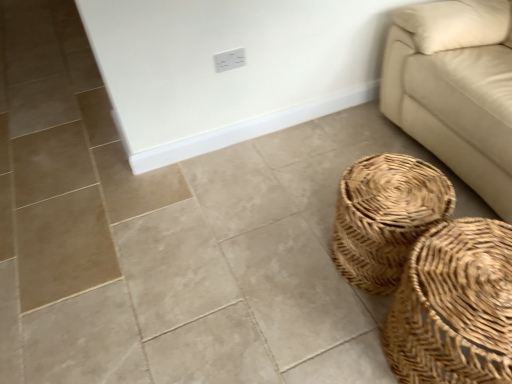
Question: Considering their positions, is woven natural basket at lower right, which appears as the first basket when viewed from the back, located in front of or behind white plastic electric outlet at upper center?

Choices:
 (A) front
 (B) behind

Answer: (A)

Question: Which is correct: woven natural basket at lower right, the second basket viewed from the front, is inside white plastic electric outlet at upper center, or outside of it?

Choices:
 (A) inside
 (B) outside

Answer: (B)

Question: Which object is the farthest from the woven natural basket at lower right, the second basket viewed from the front?

Choices:
 (A) beige leather couch at right
 (B) white plastic electric outlet at upper center
 (C) woven natural basket at lower right, which is the 1th basket from front to back

Answer: (B)

Question: Considering the real-world distances, which object is closest to the beige leather couch at right?

Choices:
 (A) white plastic electric outlet at upper center
 (B) woven natural basket at lower right, positioned as the 2th basket in back-to-front order
 (C) woven natural basket at lower right, the second basket viewed from the front

Answer: (C)